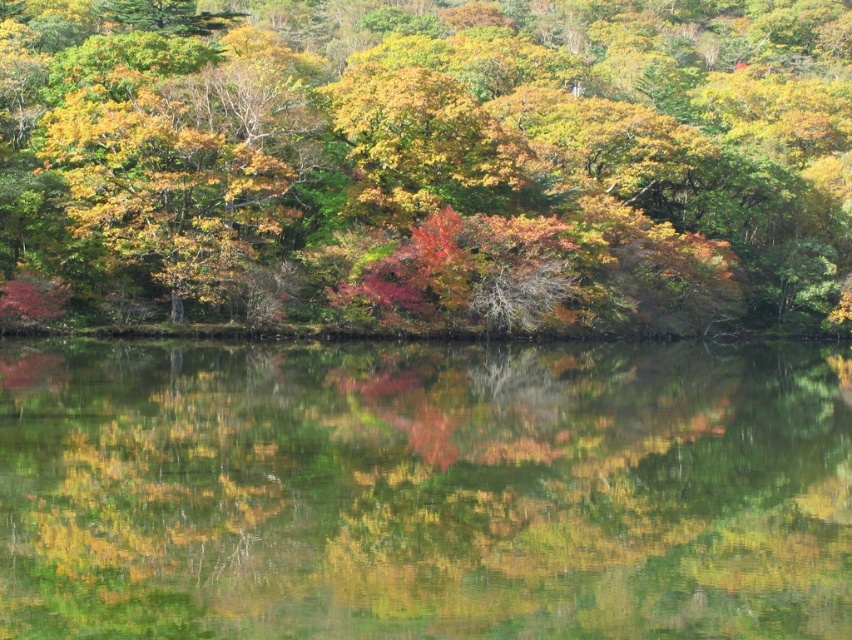
You are an artist trying to paint the scene. You notice the shiny green leaves at center and the green reflective water at center. Which object should you paint taller in your artwork to accurately represent the scene?

A: The shiny green leaves at center should be painted taller than the green reflective water at center because the shiny green leaves at center has a greater height compared to green reflective water at center according to the description.

You are standing in the autumnal landscape and want to place a small decorative stone. You have two options for placement based on the points given. Which point, point (258,172) or point (366,352), is closer to your current position?

Point (258,172) is closer to the camera than point (366,352), so placing the stone at point (258,172) would be closer to your current position.

You are standing at the center of the scene and want to pick up the shiny green leaves at center. In which direction should you move to reach them?

The shiny green leaves at center are located at the point with coordinates 0.256 on the x axis and 0.501 on the y axis. Since you are at the center of the scene, you need to move slightly to the left along the x axis and slightly forward along the y axis to reach them.